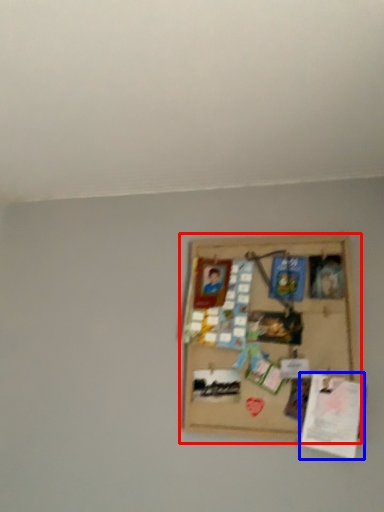
Question: Which object is further to the camera taking this photo, picture frame (highlighted by a red box) or plaque (highlighted by a blue box)?

Choices:
 (A) picture frame
 (B) plaque

Answer: (A)